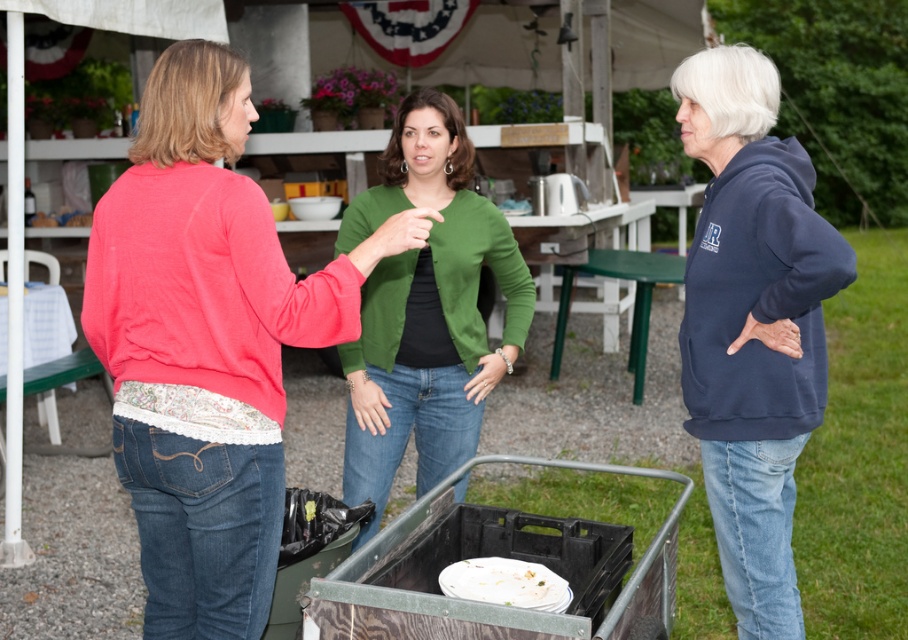
Looking at this image, does matte pink sweater at center have a lesser height compared to navy blue hoodie at right?

Indeed, matte pink sweater at center has a lesser height compared to navy blue hoodie at right.

Which of these two, matte pink sweater at center or navy blue hoodie at right, stands shorter?

matte pink sweater at center

Does point (171, 138) come closer to viewer compared to point (744, 595)?

That is True.

In order to click on matte pink sweater at center in this screenshot , I will do `click(206, 342)`.

Which of these two, matte pink sweater at center or green matte cardigan at center, stands taller?

With more height is green matte cardigan at center.

From the picture: Is matte pink sweater at center bigger than green matte cardigan at center?

Actually, matte pink sweater at center might be smaller than green matte cardigan at center.

Is point (115, 460) behind point (400, 362)?

No.

This screenshot has width=908, height=640. Identify the location of matte pink sweater at center. (206, 342).

Does metallic gray cart at lower center appear on the right side of white matte plate at lower center?

Yes, metallic gray cart at lower center is to the right of white matte plate at lower center.

Is point (421, 540) positioned after point (512, 564)?

That is False.

Is point (518, 545) closer to camera compared to point (451, 586)?

No, it is behind (451, 586).

Identify the location of metallic gray cart at lower center. (498, 556).